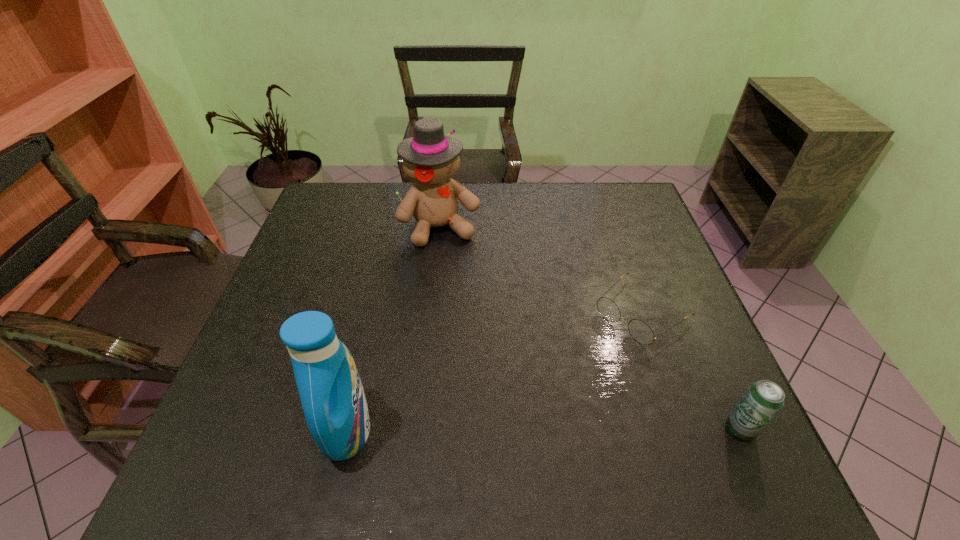
Where is `free point between the beer can and the farthest object`? free point between the beer can and the farthest object is located at coordinates (590, 328).

Find the location of `unoccupied position between the rag_doll and the detergent`. unoccupied position between the rag_doll and the detergent is located at coordinates (395, 328).

Image resolution: width=960 pixels, height=540 pixels. I want to click on vacant area between the detergent and the second shortest object, so click(x=543, y=430).

Locate an element on the screen. free space between the spectacles and the detergent is located at coordinates (494, 372).

In order to click on vacant area between the spectacles and the rag_doll in this screenshot , I will do `click(540, 269)`.

Image resolution: width=960 pixels, height=540 pixels. Identify the location of object that is the second closest to the second farthest object. (430, 158).

Identify which object is the second nearest to the rag_doll. Please provide its 2D coordinates. Your answer should be formatted as a tuple, i.e. [(x, y)], where the tuple contains the x and y coordinates of a point satisfying the conditions above.

[(331, 392)]

Locate an element on the screen. vacant space that satisfies the following two spatial constraints: 1. on the front side of the farthest object; 2. on the right side of the beer can is located at coordinates point(420,430).